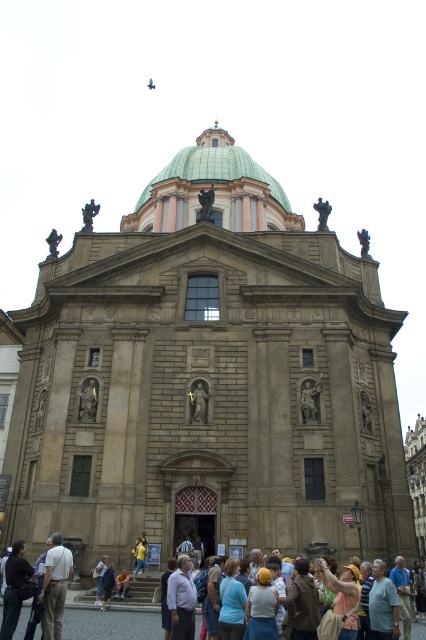
Identify the location of light blue shirt at center. (181, 600).

Can you confirm if light blue shirt at center is bigger than yellow fabric headscarf at center?

Actually, light blue shirt at center might be smaller than yellow fabric headscarf at center.

Who is more distant from viewer, (193, 604) or (267, 625)?

Positioned behind is point (193, 604).

I want to click on light blue shirt at center, so click(181, 600).

Is dark brown leather jacket at lower left above blue fabric shirt at lower right?

Correct, dark brown leather jacket at lower left is located above blue fabric shirt at lower right.

Does point (8, 579) come behind point (405, 621)?

No.

Which is in front, point (28, 580) or point (402, 608)?

Point (28, 580) is in front.

Where is `dark brown leather jacket at lower left`? This screenshot has width=426, height=640. dark brown leather jacket at lower left is located at coordinates (14, 588).

Can you confirm if green glazed dome at upper center is bigger than light brown fabric crowd at lower center?

Yes.

I want to click on green glazed dome at upper center, so click(215, 166).